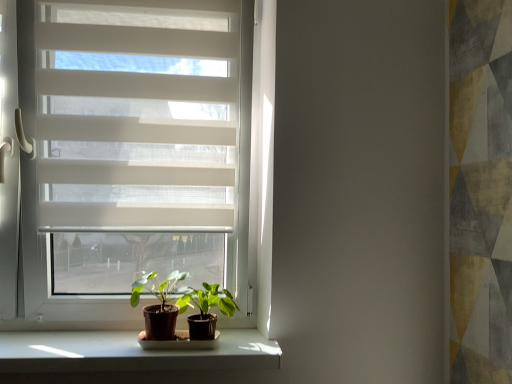
Question: Is white matte window at center at the right side of white smooth window sill at lower center?

Choices:
 (A) yes
 (B) no

Answer: (B)

Question: Considering the relative positions of white matte window at center and white smooth window sill at lower center in the image provided, is white matte window at center to the left of white smooth window sill at lower center from the viewer's perspective?

Choices:
 (A) no
 (B) yes

Answer: (B)

Question: From a real-world perspective, is white matte window at center on white smooth window sill at lower center?

Choices:
 (A) yes
 (B) no

Answer: (A)

Question: Is white matte window at center touching white smooth window sill at lower center?

Choices:
 (A) yes
 (B) no

Answer: (B)

Question: Is white matte window at center smaller than white smooth window sill at lower center?

Choices:
 (A) no
 (B) yes

Answer: (A)

Question: Can you confirm if white matte window at center is bigger than white smooth window sill at lower center?

Choices:
 (A) yes
 (B) no

Answer: (A)

Question: From a real-world perspective, is white matte window at center physically below green matte plant at center, the second houseplant positioned from the left?

Choices:
 (A) yes
 (B) no

Answer: (B)

Question: Considering the relative positions of white matte window at center and green matte plant at center, the second houseplant positioned from the left, in the image provided, is white matte window at center to the left of green matte plant at center, the second houseplant positioned from the left, from the viewer's perspective?

Choices:
 (A) yes
 (B) no

Answer: (A)

Question: Is white matte window at center outside of green matte plant at center, which appears as the first houseplant when viewed from the right?

Choices:
 (A) no
 (B) yes

Answer: (B)

Question: Is white matte window at center smaller than green matte plant at center, which appears as the first houseplant when viewed from the right?

Choices:
 (A) yes
 (B) no

Answer: (B)

Question: Is white matte window at center closer to the viewer compared to green matte plant at center, the second houseplant positioned from the left?

Choices:
 (A) no
 (B) yes

Answer: (A)

Question: Considering the relative sizes of white matte window at center and green matte plant at center, the second houseplant positioned from the left, in the image provided, is white matte window at center thinner than green matte plant at center, the second houseplant positioned from the left,?

Choices:
 (A) yes
 (B) no

Answer: (A)

Question: Can you confirm if green matte plant at center, arranged as the second houseplant when viewed from the right, is shorter than green matte plant at center, the second houseplant positioned from the left?

Choices:
 (A) no
 (B) yes

Answer: (A)